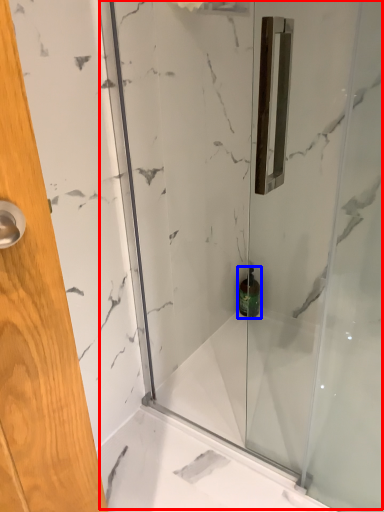
Question: Which of the following is the closest to the observer, shower door (highlighted by a red box) or toiletry (highlighted by a blue box)?

Choices:
 (A) shower door
 (B) toiletry

Answer: (A)